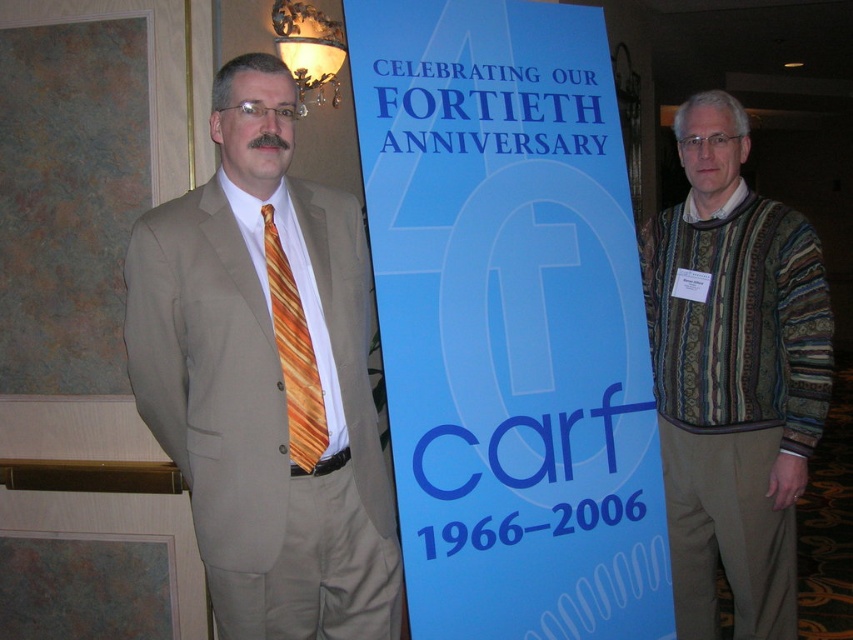
Question: Is matte beige suit at center below striped sweater at right?

Choices:
 (A) yes
 (B) no

Answer: (B)

Question: Among these points, which one is nearest to the camera?

Choices:
 (A) (599, 531)
 (B) (762, 364)
 (C) (309, 358)
 (D) (393, 570)

Answer: (C)

Question: Does blue paper sign at center appear under matte beige suit at center?

Choices:
 (A) no
 (B) yes

Answer: (A)

Question: Is matte beige suit at center above striped sweater at right?

Choices:
 (A) no
 (B) yes

Answer: (B)

Question: Which point is closer to the camera?

Choices:
 (A) (282, 292)
 (B) (758, 605)
 (C) (265, 266)
 (D) (621, 486)

Answer: (A)

Question: Which of these objects is positioned closest to the striped sweater at right?

Choices:
 (A) orange striped tie at left
 (B) matte beige suit at center

Answer: (B)